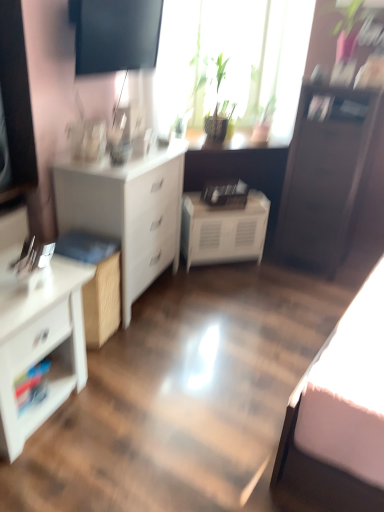
Question: Is white glossy chest of drawers at left, the 2th chest of drawers positioned from the back, positioned before dark wood file cabinet at right?

Choices:
 (A) yes
 (B) no

Answer: (A)

Question: From a real-world perspective, is white glossy chest of drawers at left, acting as the first chest of drawers starting from the front, beneath dark wood file cabinet at right?

Choices:
 (A) no
 (B) yes

Answer: (B)

Question: Is white glossy chest of drawers at left, acting as the first chest of drawers starting from the front, further to the viewer compared to dark wood file cabinet at right?

Choices:
 (A) yes
 (B) no

Answer: (B)

Question: Does white glossy chest of drawers at left, the 2th chest of drawers positioned from the back, contain dark wood file cabinet at right?

Choices:
 (A) no
 (B) yes

Answer: (A)

Question: Is white glossy chest of drawers at left, acting as the first chest of drawers starting from the front, not within dark wood file cabinet at right?

Choices:
 (A) no
 (B) yes

Answer: (B)

Question: From the image's perspective, relative to white glossy chest of drawers at left, acting as the first chest of drawers starting from the front, is green leafy plant at upper center above or below?

Choices:
 (A) below
 (B) above

Answer: (B)

Question: Which is correct: green leafy plant at upper center is inside white glossy chest of drawers at left, acting as the first chest of drawers starting from the front, or outside of it?

Choices:
 (A) inside
 (B) outside

Answer: (B)

Question: In terms of size, does green leafy plant at upper center appear bigger or smaller than white glossy chest of drawers at left, the 2th chest of drawers positioned from the back?

Choices:
 (A) small
 (B) big

Answer: (B)

Question: From a real-world perspective, is green leafy plant at upper center physically located above or below white glossy chest of drawers at left, the 2th chest of drawers positioned from the back?

Choices:
 (A) below
 (B) above

Answer: (B)

Question: Is point (180, 57) positioned closer to the camera than point (284, 233)?

Choices:
 (A) farther
 (B) closer

Answer: (B)

Question: Considering their positions, is green leafy plant at upper center located in front of or behind dark wood file cabinet at right?

Choices:
 (A) front
 (B) behind

Answer: (B)

Question: In the image, is green leafy plant at upper center on the left side or the right side of dark wood file cabinet at right?

Choices:
 (A) right
 (B) left

Answer: (B)

Question: From the image's perspective, is green leafy plant at upper center positioned above or below dark wood file cabinet at right?

Choices:
 (A) above
 (B) below

Answer: (A)

Question: Considering the positions of white matte chest of drawers at left, which is counted as the first chest of drawers, starting from the back, and white glossy chest of drawers at left, acting as the first chest of drawers starting from the front, in the image, is white matte chest of drawers at left, which is counted as the first chest of drawers, starting from the back, wider or thinner than white glossy chest of drawers at left, acting as the first chest of drawers starting from the front,?

Choices:
 (A) thin
 (B) wide

Answer: (B)

Question: Is point (94, 202) closer or farther from the camera than point (18, 357)?

Choices:
 (A) farther
 (B) closer

Answer: (A)